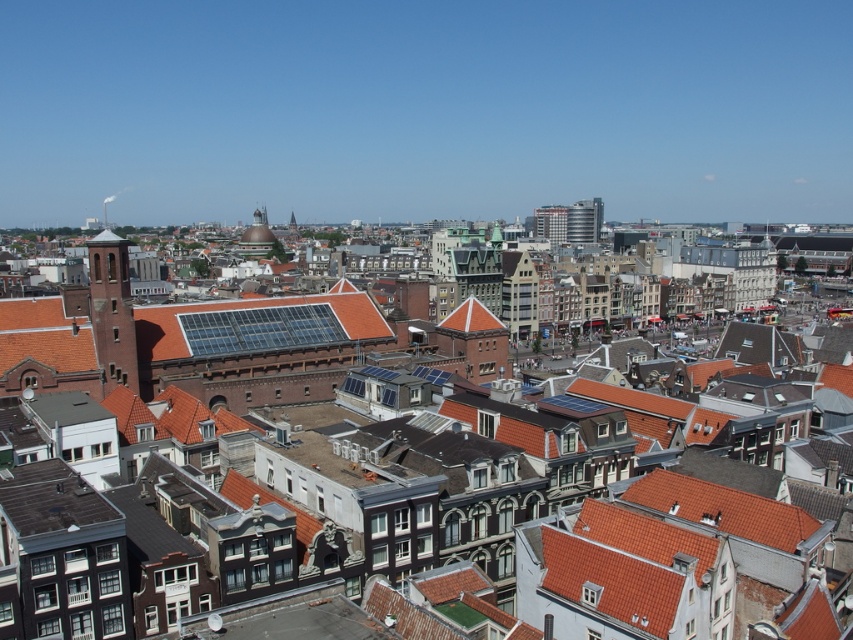
Is point (90, 332) positioned after point (119, 296)?

That is True.

Who is taller, brown tiled roof at center or dark brown stone tower at left?

Standing taller between the two is brown tiled roof at center.

Is point (276, 371) farther from camera compared to point (102, 285)?

Yes, point (276, 371) is behind point (102, 285).

What are the coordinates of `brown tiled roof at center` in the screenshot? It's located at (260, 342).

Who is lower down, brown tiled roof at center or translucent glass solar panels at center?

translucent glass solar panels at center

Is point (209, 321) closer to camera compared to point (154, 317)?

That is False.

Where is `brown tiled roof at center`? The image size is (853, 640). brown tiled roof at center is located at coordinates (260, 342).

How much distance is there between translucent glass solar panels at center and dark brown stone tower at left?

translucent glass solar panels at center and dark brown stone tower at left are 21.88 meters apart from each other.

From the picture: Can you confirm if translucent glass solar panels at center is smaller than dark brown stone tower at left?

Actually, translucent glass solar panels at center might be larger than dark brown stone tower at left.

Is point (148, 348) behind point (117, 241)?

Yes.

Identify the location of translucent glass solar panels at center. (258, 324).